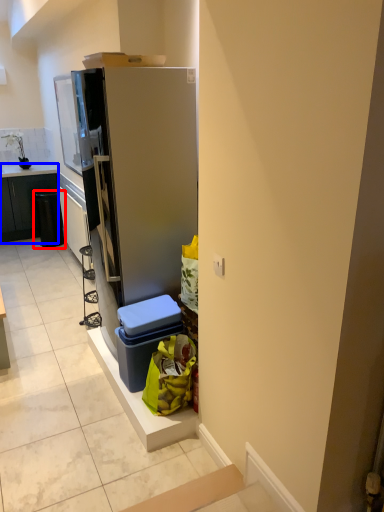
Question: Which point is further to the camera, recycling bin (highlighted by a red box) or cabinetry (highlighted by a blue box)?

Choices:
 (A) recycling bin
 (B) cabinetry

Answer: (B)